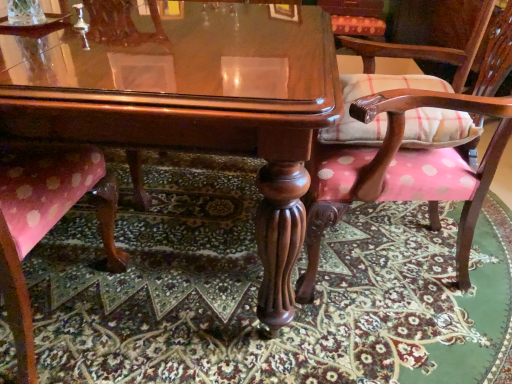
Image resolution: width=512 pixels, height=384 pixels. What do you see at coordinates (413, 164) in the screenshot?
I see `pink polka dot fabric chair at center, the 2th chair in the front-to-back sequence` at bounding box center [413, 164].

In order to click on pink polka dot fabric chair at lower left, acting as the third chair starting from the back in this screenshot , I will do `click(46, 222)`.

Measure the distance between point (72, 165) and camera.

3.78 feet.

Describe the element at coordinates (378, 114) in the screenshot. I see `plaid fabric pillow at right` at that location.

The image size is (512, 384). What are the coordinates of `pink polka dot fabric chair at center, the 2th chair viewed from the back` in the screenshot? It's located at (413, 164).

In the image, is pink polka dot fabric at lower center positioned in front of or behind plaid fabric cushion at upper right, the first chair viewed from the right?

pink polka dot fabric at lower center is positioned closer to the viewer than plaid fabric cushion at upper right, the first chair viewed from the right.

Could you tell me if pink polka dot fabric at lower center is turned towards plaid fabric cushion at upper right, the third chair viewed from the front?

No, pink polka dot fabric at lower center is not aimed at plaid fabric cushion at upper right, the third chair viewed from the front.

Considering the relative sizes of pink polka dot fabric at lower center and plaid fabric cushion at upper right, the first chair viewed from the right, in the image provided, is pink polka dot fabric at lower center thinner than plaid fabric cushion at upper right, the first chair viewed from the right,?

No, pink polka dot fabric at lower center is not thinner than plaid fabric cushion at upper right, the first chair viewed from the right.

Which chair is the 2nd one when counting from the back of the glossy wood table at center? Please provide its 2D coordinates.

[(356, 18)]

Is plaid fabric cushion at upper right, the first chair when ordered from back to front, looking in the opposite direction of glossy wood table at center?

plaid fabric cushion at upper right, the first chair when ordered from back to front, is not turned away from glossy wood table at center.

Are plaid fabric cushion at upper right, the first chair viewed from the right, and glossy wood table at center beside each other?

No, plaid fabric cushion at upper right, the first chair viewed from the right, is not touching glossy wood table at center.

From the image's perspective, is plaid fabric cushion at upper right, the first chair viewed from the right, located above or below glossy wood table at center?

From the image's perspective, plaid fabric cushion at upper right, the first chair viewed from the right, appears above glossy wood table at center.

Does point (334, 94) lie behind point (66, 183)?

No, it is not.

Is glossy wood table at center wider or thinner than pink polka dot fabric chair at lower left, which is counted as the 1th chair, starting from the left?

Clearly, glossy wood table at center has more width compared to pink polka dot fabric chair at lower left, which is counted as the 1th chair, starting from the left.

Considering the sizes of glossy wood table at center and pink polka dot fabric chair at lower left, the 3th chair when ordered from right to left, in the image, is glossy wood table at center taller or shorter than pink polka dot fabric chair at lower left, the 3th chair when ordered from right to left,?

In the image, glossy wood table at center appears to be shorter than pink polka dot fabric chair at lower left, the 3th chair when ordered from right to left.

Could pink polka dot fabric chair at lower left, which is counted as the 1th chair, starting from the front, be considered to be inside glossy wood table at center?

Yes, pink polka dot fabric chair at lower left, which is counted as the 1th chair, starting from the front, can be found within glossy wood table at center.

From a real-world perspective, is pink polka dot fabric chair at center, the 2th chair in the front-to-back sequence, over glossy wood table at center?

Indeed, from a real-world perspective, pink polka dot fabric chair at center, the 2th chair in the front-to-back sequence, stands above glossy wood table at center.

Considering the points (357, 164) and (203, 50), which point is in front, point (357, 164) or point (203, 50)?

The point (203, 50) is in front.

Does pink polka dot fabric chair at center, marked as the 2th chair in a left-to-right arrangement, touch glossy wood table at center?

No.

From the picture: Is pink polka dot fabric chair at center, the 2th chair viewed from the back, turned away from glossy wood table at center?

That's not correct — pink polka dot fabric chair at center, the 2th chair viewed from the back, is not looking away from glossy wood table at center.

Considering the sizes of pink polka dot fabric chair at center, the 2th chair viewed from the back, and plaid fabric cushion at upper right, the first chair viewed from the right, in the image, is pink polka dot fabric chair at center, the 2th chair viewed from the back, bigger or smaller than plaid fabric cushion at upper right, the first chair viewed from the right,?

In the image, pink polka dot fabric chair at center, the 2th chair viewed from the back, appears to be larger than plaid fabric cushion at upper right, the first chair viewed from the right.

Considering their positions, is pink polka dot fabric chair at center, the 2th chair viewed from the back, located in front of or behind plaid fabric cushion at upper right, the third chair viewed from the front?

Visually, pink polka dot fabric chair at center, the 2th chair viewed from the back, is located in front of plaid fabric cushion at upper right, the third chair viewed from the front.

In order to click on the 2nd chair below the pink polka dot fabric chair at center, the 2th chair viewed from the back (from a real-world perspective) in this screenshot , I will do click(356, 18).

Is point (434, 225) more distant than point (321, 2)?

That is False.

Considering the relative sizes of plaid fabric cushion at upper right, the third chair viewed from the front, and pink polka dot fabric at lower center in the image provided, is plaid fabric cushion at upper right, the third chair viewed from the front, taller than pink polka dot fabric at lower center?

Yes, plaid fabric cushion at upper right, the third chair viewed from the front, is taller than pink polka dot fabric at lower center.

Is plaid fabric cushion at upper right, the third chair positioned from the left, next to pink polka dot fabric at lower center and touching it?

No.

Considering the points (336, 45) and (443, 249), which point is in front, point (336, 45) or point (443, 249)?

The point (443, 249) is more forward.

How different are the orientations of plaid fabric cushion at upper right, the first chair when ordered from back to front, and pink polka dot fabric at lower center in degrees?

The angular difference between plaid fabric cushion at upper right, the first chair when ordered from back to front, and pink polka dot fabric at lower center is 178 degrees.

Would you say plaid fabric pillow at right is to the left or to the right of plaid fabric cushion at upper right, the third chair positioned from the left, in the picture?

plaid fabric pillow at right is to the left of plaid fabric cushion at upper right, the third chair positioned from the left.

Consider the image. Does plaid fabric pillow at right have a lesser height compared to plaid fabric cushion at upper right, the first chair viewed from the right?

Indeed, plaid fabric pillow at right has a lesser height compared to plaid fabric cushion at upper right, the first chair viewed from the right.

Is plaid fabric cushion at upper right, the third chair viewed from the front, inside plaid fabric pillow at right?

No, plaid fabric cushion at upper right, the third chair viewed from the front, is not surrounded by plaid fabric pillow at right.

Identify the location of mat that appears on the left of plaid fabric cushion at upper right, the third chair viewed from the front. This screenshot has width=512, height=384. (257, 290).

Identify the location of the 1st chair above the glossy wood table at center (from a real-world perspective). (356, 18).

Considering their positions, is plaid fabric cushion at upper right, the third chair viewed from the front, positioned further to pink polka dot fabric at lower center than glossy wood table at center?

plaid fabric cushion at upper right, the third chair viewed from the front.

When comparing their distances from pink polka dot fabric chair at center, marked as the second chair in a right-to-left arrangement, does plaid fabric pillow at right or pink polka dot fabric chair at lower left, acting as the third chair starting from the back, seem closer?

plaid fabric pillow at right is closer to pink polka dot fabric chair at center, marked as the second chair in a right-to-left arrangement.

When comparing their distances from glossy wood table at center, does pink polka dot fabric chair at lower left, acting as the third chair starting from the back, or pink polka dot fabric chair at center, marked as the 2th chair in a left-to-right arrangement, seem closer?

pink polka dot fabric chair at lower left, acting as the third chair starting from the back, lies closer to glossy wood table at center than the other object.

Consider the image. Which object lies further to the anchor point pink polka dot fabric at lower center, pink polka dot fabric chair at lower left, acting as the third chair starting from the back, or pink polka dot fabric chair at center, marked as the second chair in a right-to-left arrangement?

pink polka dot fabric chair at lower left, acting as the third chair starting from the back, lies further to pink polka dot fabric at lower center than the other object.

Considering their positions, is pink polka dot fabric at lower center positioned closer to plaid fabric cushion at upper right, the first chair viewed from the right, than glossy wood table at center?

glossy wood table at center lies closer to plaid fabric cushion at upper right, the first chair viewed from the right, than the other object.

Looking at the image, which one is located further to plaid fabric pillow at right, pink polka dot fabric chair at center, marked as the 2th chair in a left-to-right arrangement, or pink polka dot fabric at lower center?

The object further to plaid fabric pillow at right is pink polka dot fabric at lower center.

Looking at this image, looking at the image, which one is located further to pink polka dot fabric chair at center, marked as the 2th chair in a left-to-right arrangement, pink polka dot fabric at lower center or plaid fabric cushion at upper right, the first chair viewed from the right?

The object further to pink polka dot fabric chair at center, marked as the 2th chair in a left-to-right arrangement, is plaid fabric cushion at upper right, the first chair viewed from the right.

Considering their positions, is pink polka dot fabric chair at lower left, which is counted as the 1th chair, starting from the front, positioned further to pink polka dot fabric chair at center, the 2th chair viewed from the back, than plaid fabric pillow at right?

pink polka dot fabric chair at lower left, which is counted as the 1th chair, starting from the front, is positioned further to the anchor pink polka dot fabric chair at center, the 2th chair viewed from the back.

I want to click on table located between pink polka dot fabric chair at lower left, which is counted as the 1th chair, starting from the left, and pink polka dot fabric at lower center in the left-right direction, so click(189, 98).

Image resolution: width=512 pixels, height=384 pixels. What are the coordinates of `mat situated between glossy wood table at center and plaid fabric pillow at right from left to right` in the screenshot? It's located at (257, 290).

Identify the location of mat between glossy wood table at center and pink polka dot fabric chair at center, marked as the 2th chair in a left-to-right arrangement. (257, 290).

Locate an element on the screen. The image size is (512, 384). mat positioned between pink polka dot fabric chair at lower left, acting as the third chair starting from the back, and plaid fabric cushion at upper right, the first chair viewed from the right, from near to far is located at coordinates (257, 290).